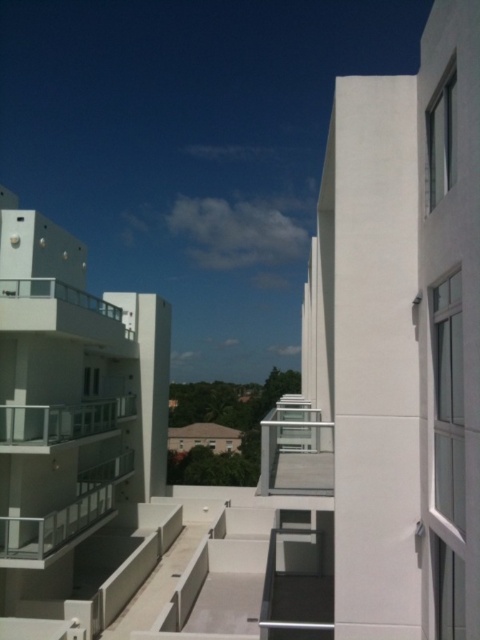
Question: Does clear glass balcony at center appear on the left side of clear glass balcony at left?

Choices:
 (A) no
 (B) yes

Answer: (B)

Question: Where is clear glass balcony at center located in relation to clear glass balcony at left in the image?

Choices:
 (A) below
 (B) above

Answer: (A)

Question: Which of the following is the farthest from the observer?

Choices:
 (A) clear glass balcony at center
 (B) clear glass balcony at left

Answer: (B)

Question: Is clear glass balcony at center thinner than clear glass balcony at left?

Choices:
 (A) yes
 (B) no

Answer: (A)